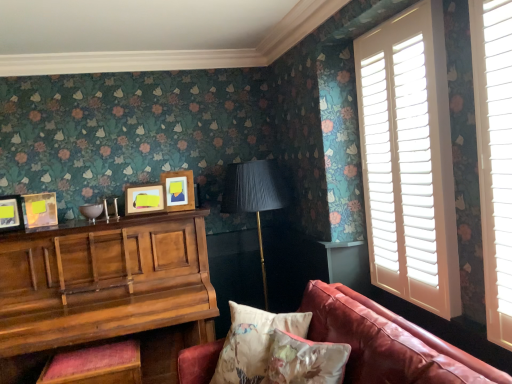
The image size is (512, 384). I want to click on blank area beneath matte yellow picture frame at left, the 2th picture frame when ordered from left to right (from a real-world perspective), so click(x=42, y=228).